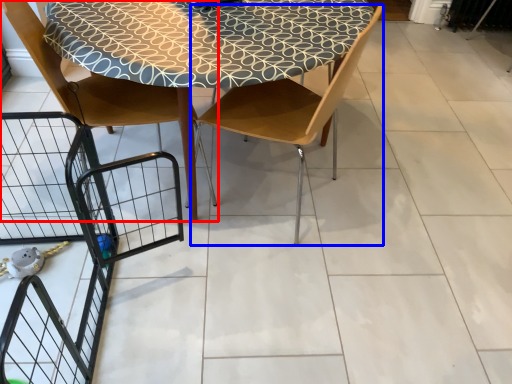
Question: Which of the following is the farthest to the observer, chair (highlighted by a red box) or chair (highlighted by a blue box)?

Choices:
 (A) chair
 (B) chair

Answer: (A)